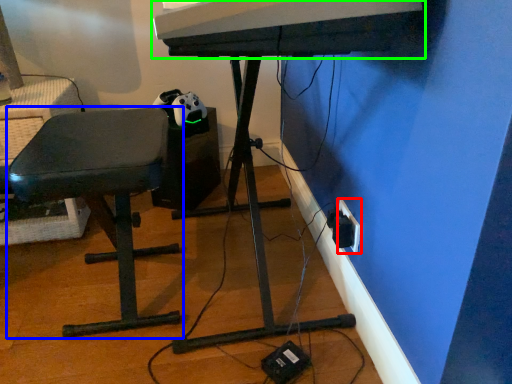
Question: Which is nearer to the electric outlet (highlighted by a red box)? furniture (highlighted by a blue box) or musical keyboard (highlighted by a green box).

Choices:
 (A) furniture
 (B) musical keyboard

Answer: (B)